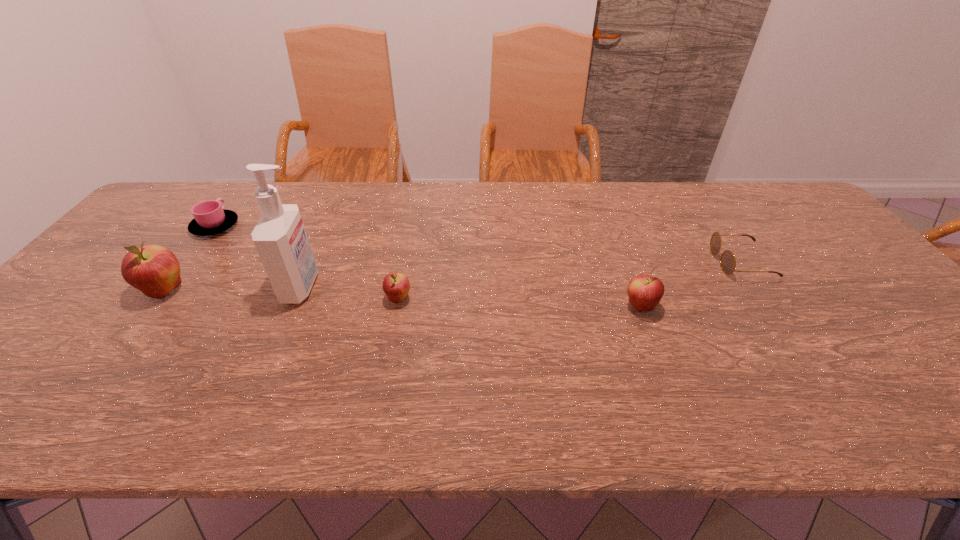
Identify the location of the second tallest object. (154, 270).

At what (x,y) coordinates should I click in order to perform the action: click on the leftmost apple. Please return your answer as a coordinate pair (x, y). Looking at the image, I should click on (154, 270).

Locate an element on the screen. This screenshot has width=960, height=540. the third object from right to left is located at coordinates (396, 286).

Find the location of a particular element. This screenshot has height=540, width=960. the shortest apple is located at coordinates (396, 286).

Locate an element on the screen. The height and width of the screenshot is (540, 960). the third tallest object is located at coordinates (645, 292).

Where is `the second shortest apple`? Image resolution: width=960 pixels, height=540 pixels. the second shortest apple is located at coordinates (645, 292).

Locate an element on the screen. The height and width of the screenshot is (540, 960). sunglasses is located at coordinates (727, 261).

You are a GUI agent. You are given a task and a screenshot of the screen. Output one action in this format:
    pyautogui.click(x=<x>, y=<y>)
    Task: Click on the tallest object
    
    Given the screenshot: What is the action you would take?
    pyautogui.click(x=280, y=238)

You are a GUI agent. You are given a task and a screenshot of the screen. Output one action in this format:
    pyautogui.click(x=<x>, y=<y>)
    Task: Click on the cleansing agent
    The width and height of the screenshot is (960, 540).
    Given the screenshot: What is the action you would take?
    pyautogui.click(x=280, y=238)

Locate an element on the screen. the farthest object is located at coordinates (210, 218).